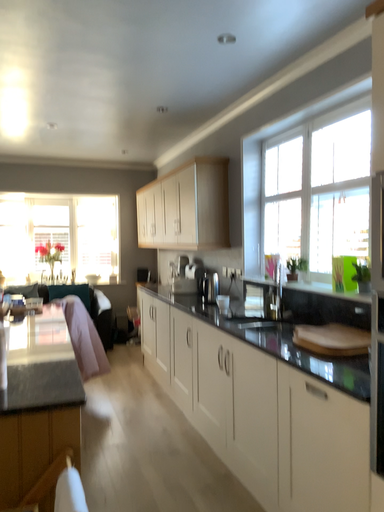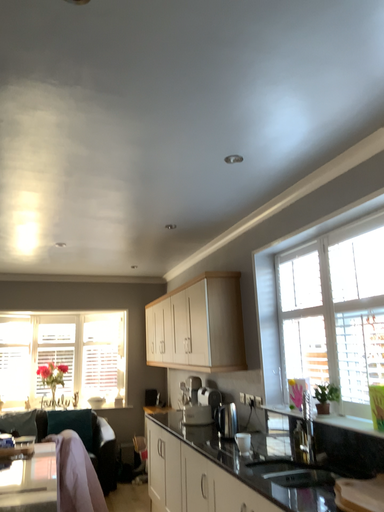
Question: Which way did the camera rotate in the video?

Choices:
 (A) rotated downward
 (B) rotated upward

Answer: (B)